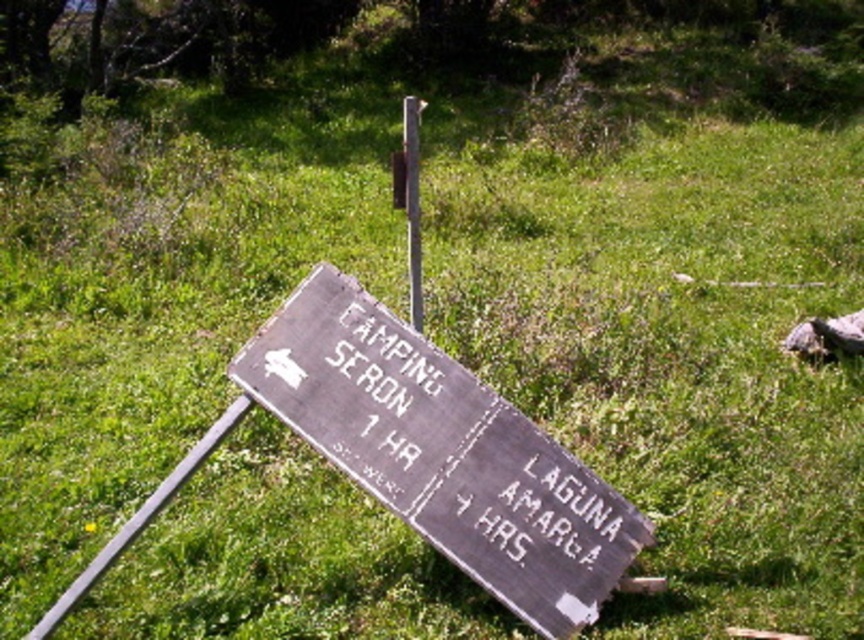
Question: Observing the image, what is the correct spatial positioning of weathered wood sign at lower center in reference to metallic pole at center?

Choices:
 (A) above
 (B) below

Answer: (B)

Question: Which point is closer to the camera?

Choices:
 (A) (411, 192)
 (B) (348, 353)

Answer: (B)

Question: Does weathered wood sign at lower center have a larger size compared to metallic pole at center?

Choices:
 (A) yes
 (B) no

Answer: (B)

Question: Is weathered wood sign at lower center behind metallic pole at center?

Choices:
 (A) no
 (B) yes

Answer: (A)